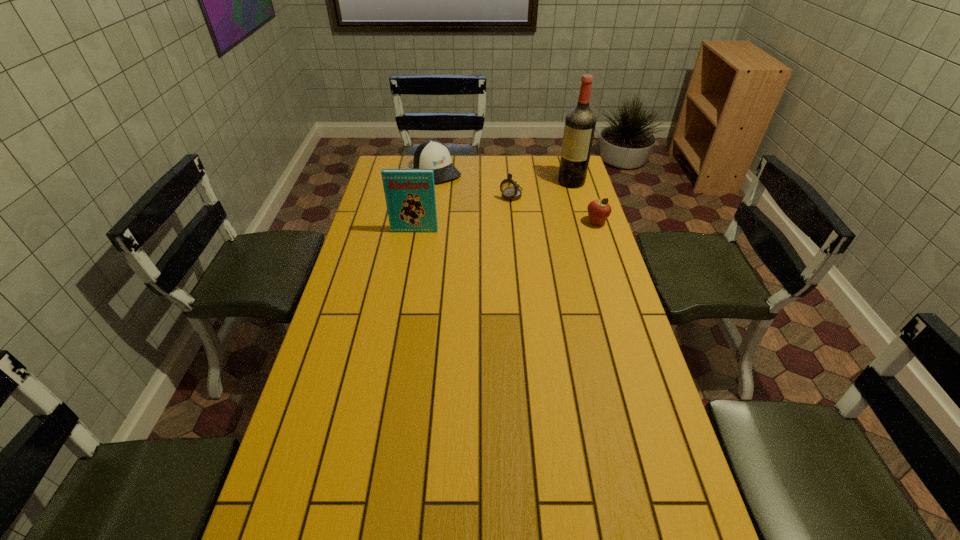
At what (x,y) coordinates should I click in order to perform the action: click on book. Please return your answer as a coordinate pair (x, y). This screenshot has width=960, height=540. Looking at the image, I should click on (410, 197).

Locate an element on the screen. The height and width of the screenshot is (540, 960). apple is located at coordinates (599, 210).

At what (x,y) coordinates should I click in order to perform the action: click on compass. Please return your answer as a coordinate pair (x, y). The image size is (960, 540). Looking at the image, I should click on (509, 188).

You are a GUI agent. You are given a task and a screenshot of the screen. Output one action in this format:
    pyautogui.click(x=<x>, y=<y>)
    Task: Click on the liquor
    
    Given the screenshot: What is the action you would take?
    pyautogui.click(x=580, y=122)

At what (x,y) coordinates should I click in order to perform the action: click on cap. Please return your answer as a coordinate pair (x, y). The image size is (960, 540). Looking at the image, I should click on (432, 154).

Where is `vacant space located on the front cover of the fourth shortest object`? vacant space located on the front cover of the fourth shortest object is located at coordinates (413, 241).

Find the location of a particular element. This screenshot has height=540, width=960. free space located on the left of the apple is located at coordinates (551, 223).

The height and width of the screenshot is (540, 960). Identify the location of vacant area situated 0.170m on the face of the compass. (487, 224).

What are the coordinates of `free location located on the face of the compass` in the screenshot? It's located at (473, 240).

Where is `vacant space located 0.380m on the face of the compass`? Image resolution: width=960 pixels, height=540 pixels. vacant space located 0.380m on the face of the compass is located at coordinates (459, 255).